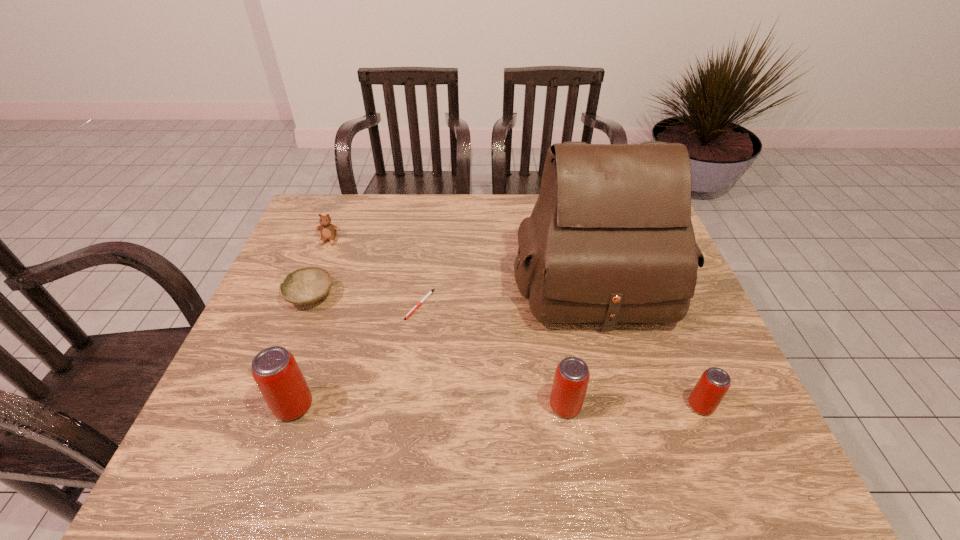
I want to click on object that is the second nearest to the satchel, so click(709, 391).

Locate an element on the screen. This screenshot has width=960, height=540. object that is the fourth closest to the leftmost beer can is located at coordinates (328, 231).

Select which beer can appears as the closest to the fourth shortest object. Please provide its 2D coordinates. Your answer should be formatted as a tuple, i.e. [(x, y)], where the tuple contains the x and y coordinates of a point satisfying the conditions above.

[(571, 379)]

Locate an element on the screen. This screenshot has height=540, width=960. the second closest beer can to the rightmost beer can is located at coordinates (275, 370).

At what (x,y) coordinates should I click in order to perform the action: click on vacant space that satisfies the following two spatial constraints: 1. on the front-facing side of the teddy bear; 2. on the left side of the leftmost beer can. Please return your answer as a coordinate pair (x, y). The image size is (960, 540). Looking at the image, I should click on (262, 406).

Locate an element on the screen. This screenshot has height=540, width=960. free region that satisfies the following two spatial constraints: 1. on the front-facing side of the teddy bear; 2. on the left side of the shortest beer can is located at coordinates (263, 406).

Locate an element on the screen. free spot that satisfies the following two spatial constraints: 1. on the clicker of the second shortest beer can; 2. on the left side of the shortest object is located at coordinates (406, 406).